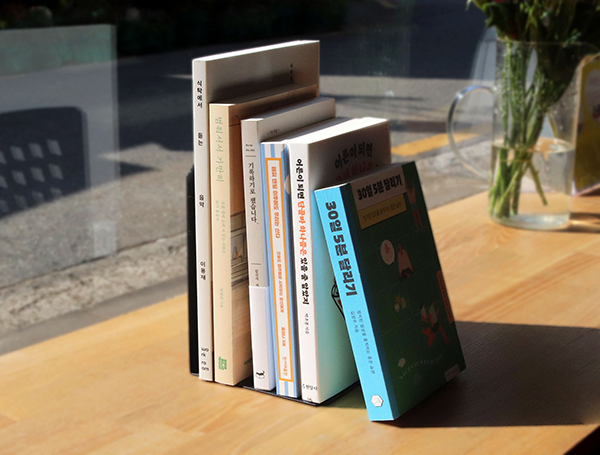
This screenshot has height=455, width=600. What are the coordinates of `books` in the screenshot? It's located at [x=199, y=223], [x=219, y=227], [x=252, y=225], [x=277, y=225], [x=298, y=222], [x=340, y=234].